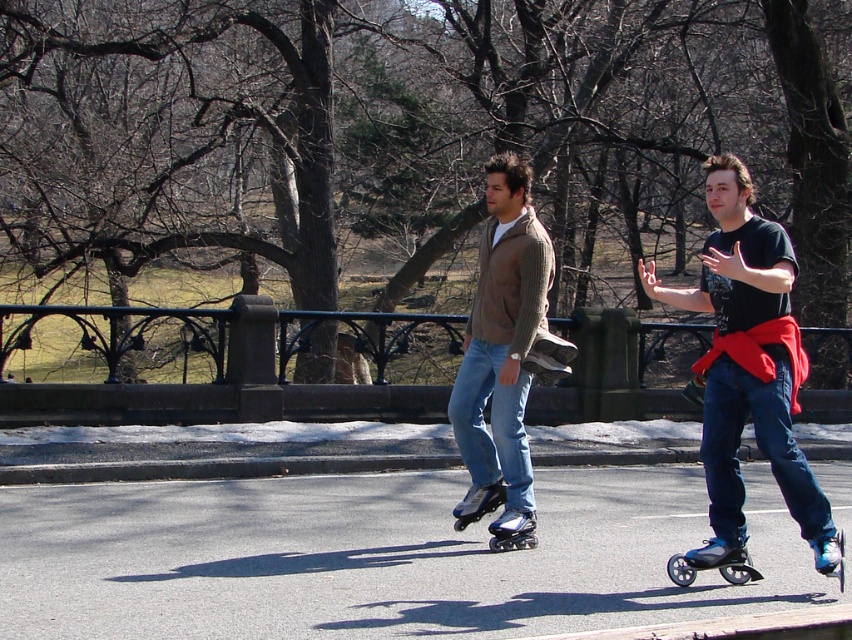
You are a photographer trying to capture both the blue matte roller skates at right and the black matte roller skate at lower right in a single shot. Based on their sizes, which roller skate will appear larger in the photo?

The blue matte roller skates at right will appear larger in the photo because it is bigger than the black matte roller skate at lower right.

You are a photographer trying to capture a photo of both the blue matte roller skates at right and the shiny black roller skate at center. Based on their heights, which roller skate will appear larger in the photo?

The blue matte roller skates at right will appear larger in the photo because they are much taller than the shiny black roller skate at center.